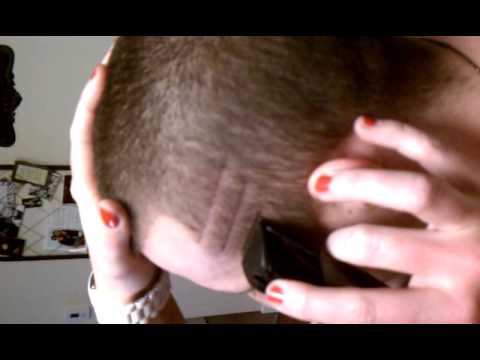
Where is `thermostat`? thermostat is located at coordinates (73, 309).